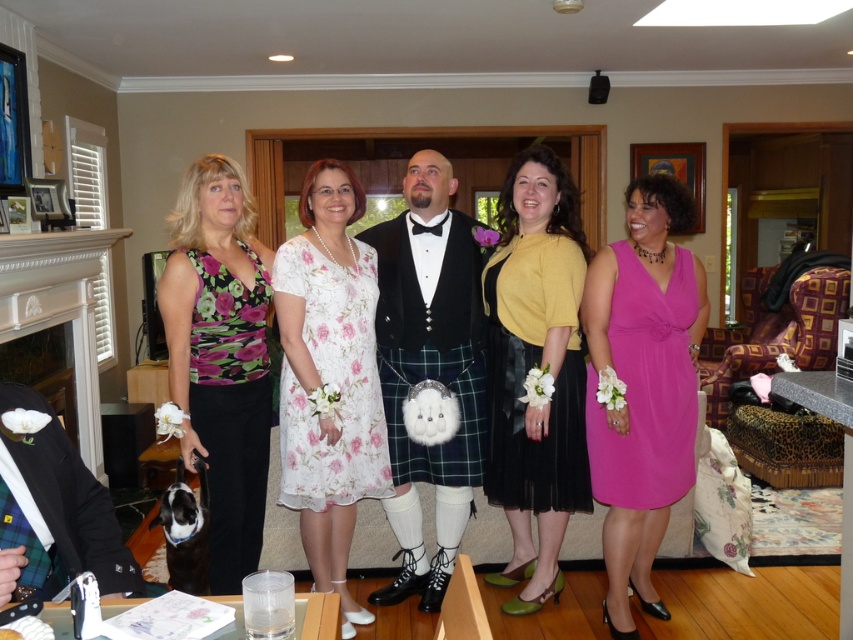
Question: Is floral fabric dress at center wider than floral fabric dress at left?

Choices:
 (A) no
 (B) yes

Answer: (B)

Question: Which of the following is the closest to the observer?

Choices:
 (A) floral fabric dress at center
 (B) floral fabric dress at left
 (C) velvet black vest at center

Answer: (B)

Question: Among these points, which one is nearest to the camera?

Choices:
 (A) (480, 426)
 (B) (299, 401)
 (C) (386, 413)
 (D) (238, 528)

Answer: (D)

Question: Does matte pink dress at right appear on the right side of black plaid kilt at center?

Choices:
 (A) no
 (B) yes

Answer: (B)

Question: Can you confirm if floral fabric dress at center is positioned to the left of yellow matte dress at center?

Choices:
 (A) no
 (B) yes

Answer: (B)

Question: Which point appears farthest from the camera in this image?

Choices:
 (A) (311, 426)
 (B) (519, 483)
 (C) (456, 360)

Answer: (C)